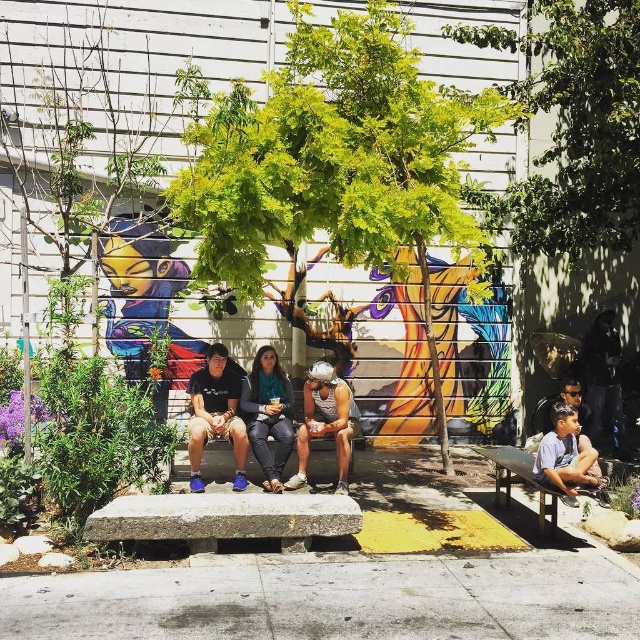
You are standing in the outdoor scene and want to take a photo of the green leafy tree at center. Where should you look to find it?

The green leafy tree at center is located at point coordinates of (339, 163).

You are standing in front of the gray concrete bench at center and want to take a photo of the vibrant mural behind the green leafy tree at center. Can you see the mural clearly through the tree?

The green leafy tree at center is further to the viewer than the gray concrete bench at center, meaning the tree is between you and the mural. This would block your view of the mural, so you cannot see it clearly through the tree.